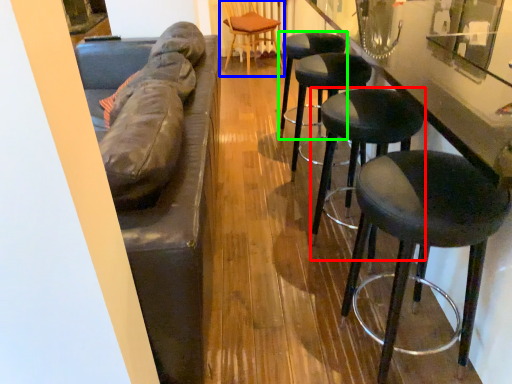
Question: Considering the real-world distances, which object is closest to stool (highlighted by a red box)? chair (highlighted by a blue box) or stool (highlighted by a green box).

Choices:
 (A) chair
 (B) stool

Answer: (B)